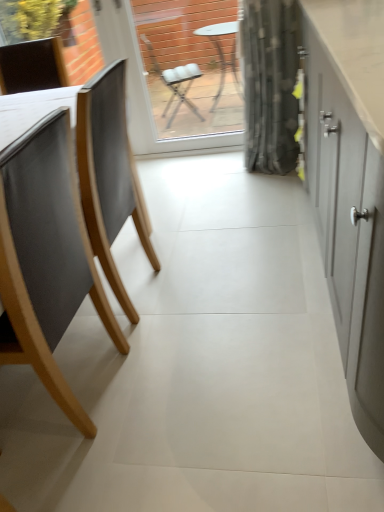
This screenshot has width=384, height=512. Describe the element at coordinates (46, 257) in the screenshot. I see `matte wood chair at left` at that location.

Image resolution: width=384 pixels, height=512 pixels. In order to click on matte gray cabinet at right in this screenshot , I will do `click(350, 187)`.

Is matte gray cabinet at right completely or partially outside of matte wood chair at left?

Yes, matte gray cabinet at right is outside of matte wood chair at left.

Considering the sizes of matte gray cabinet at right and matte wood chair at left in the image, is matte gray cabinet at right bigger or smaller than matte wood chair at left?

matte gray cabinet at right is bigger than matte wood chair at left.

Which is in front, matte gray cabinet at right or matte wood chair at left?

matte gray cabinet at right is in front.

Is matte gray cabinet at right positioned with its back to matte wood chair at left?

Yes, matte gray cabinet at right is positioned with its back facing matte wood chair at left.

Does matte gray cabinet at right have a lesser height compared to transparent glass window screen at center?

Incorrect, the height of matte gray cabinet at right does not fall short of that of transparent glass window screen at center.

From a real-world perspective, is matte gray cabinet at right positioned above or below transparent glass window screen at center?

In terms of real-world spatial position, matte gray cabinet at right is below transparent glass window screen at center.

Which is more to the left, matte gray cabinet at right or transparent glass window screen at center?

transparent glass window screen at center is more to the left.

Is matte gray cabinet at right positioned far away from transparent glass window screen at center?

Indeed, matte gray cabinet at right is not near transparent glass window screen at center.

Considering their positions, is transparent glass window screen at center located in front of or behind matte wood chair at left?

Clearly, transparent glass window screen at center is behind matte wood chair at left.

From the image's perspective, which object appears higher, transparent glass window screen at center or matte wood chair at left?

From the image's view, transparent glass window screen at center is above.

Looking at this image, looking at their sizes, would you say transparent glass window screen at center is wider or thinner than matte wood chair at left?

In the image, transparent glass window screen at center appears to be more narrow than matte wood chair at left.

Which is closer, (68, 118) or (227, 83)?

Point (68, 118) appears to be closer to the viewer than point (227, 83).

Consider the image. Would you say matte wood chair at left is a long distance from transparent glass window screen at center?

Yes.

What's the angular difference between matte wood chair at left and transparent glass window screen at center's facing directions?

The angular difference between matte wood chair at left and transparent glass window screen at center is 92.7 degrees.

Is point (193, 122) farther from viewer compared to point (367, 75)?

Yes, point (193, 122) is farther from viewer.

From the image's perspective, which is below, transparent glass window screen at center or matte gray cabinet at right?

matte gray cabinet at right.

Which of these two, transparent glass window screen at center or matte gray cabinet at right, stands shorter?

transparent glass window screen at center.

Which is more to the right, transparent glass window screen at center or matte gray cabinet at right?

From the viewer's perspective, matte gray cabinet at right appears more on the right side.

Considering the positions of objects matte wood chair at left and matte gray cabinet at right in the image provided, who is more to the right, matte wood chair at left or matte gray cabinet at right?

matte gray cabinet at right is more to the right.

Considering the positions of points (6, 210) and (363, 381), is point (6, 210) farther from camera compared to point (363, 381)?

No, (6, 210) is in front of (363, 381).

Is matte wood chair at left far away from matte gray cabinet at right?

No.

Would you say matte wood chair at left is inside or outside matte gray cabinet at right?

matte wood chair at left is not enclosed by matte gray cabinet at right.

Where is `chair behind the matte gray cabinet at right`? chair behind the matte gray cabinet at right is located at coordinates (46, 257).

Locate an element on the screen. This screenshot has height=512, width=384. cabinetry on the right of transparent glass window screen at center is located at coordinates (350, 187).

Considering their positions, is matte wood chair at left positioned further to transparent glass window screen at center than matte gray cabinet at right?

The object further to transparent glass window screen at center is matte wood chair at left.

Estimate the real-world distances between objects in this image. Which object is closer to matte gray cabinet at right, matte wood chair at left or transparent glass window screen at center?

matte wood chair at left is closer to matte gray cabinet at right.

From the image, which object appears to be nearer to matte wood chair at left, matte gray cabinet at right or transparent glass window screen at center?

matte gray cabinet at right lies closer to matte wood chair at left than the other object.

From the image, which object appears to be farther from matte wood chair at left, transparent glass window screen at center or matte gray cabinet at right?

transparent glass window screen at center.

In the scene shown: Estimate the real-world distances between objects in this image. Which object is further from transparent glass window screen at center, matte gray cabinet at right or matte wood chair at left?

matte wood chair at left is positioned further to the anchor transparent glass window screen at center.

Considering their positions, is transparent glass window screen at center positioned closer to matte gray cabinet at right than matte wood chair at left?

matte wood chair at left is positioned closer to the anchor matte gray cabinet at right.

Identify the location of chair located between matte gray cabinet at right and transparent glass window screen at center in the depth direction. (46, 257).